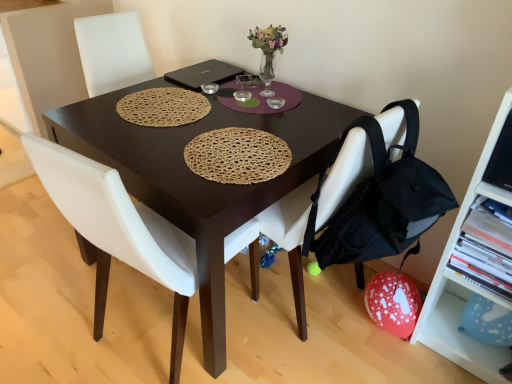
Where is `vacant space that's between white fabric chair at center, positioned as the second chair in left-to-right order, and dark brown wooden desk at center`? vacant space that's between white fabric chair at center, positioned as the second chair in left-to-right order, and dark brown wooden desk at center is located at coordinates (272, 353).